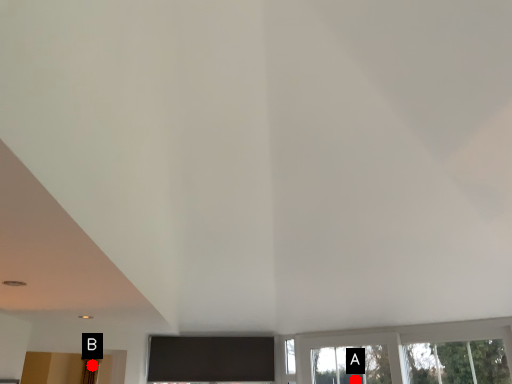
Question: Two points are circled on the image, labeled by A and B beside each circle. Which point is farther from the camera taking this photo?

Choices:
 (A) A is further
 (B) B is further

Answer: (A)